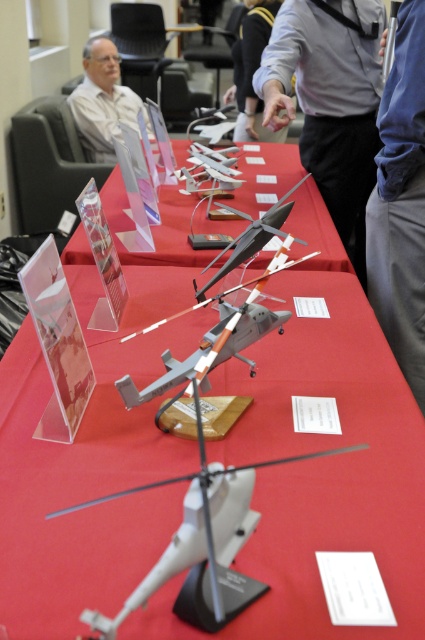
Question: Considering the real-world distances, which object is farthest from the blue fabric shirt at upper center?

Choices:
 (A) red matte tablecloth at center
 (B) matte plastic model airplane at center

Answer: (A)

Question: Can you confirm if gray fabric shirt at upper center is smaller than matte gray hair at upper left?

Choices:
 (A) yes
 (B) no

Answer: (A)

Question: Can you confirm if red matte tablecloth at center is wider than gray fabric shirt at upper center?

Choices:
 (A) yes
 (B) no

Answer: (A)

Question: In this image, where is red matte tablecloth at center located relative to gray fabric shirt at upper center?

Choices:
 (A) below
 (B) above

Answer: (A)

Question: Which object appears farthest from the camera in this image?

Choices:
 (A) matte plastic model airplane at center
 (B) gray fabric shirt at upper center

Answer: (B)

Question: Which point is closer to the camera taking this photo?

Choices:
 (A) (150, 317)
 (B) (248, 54)

Answer: (A)